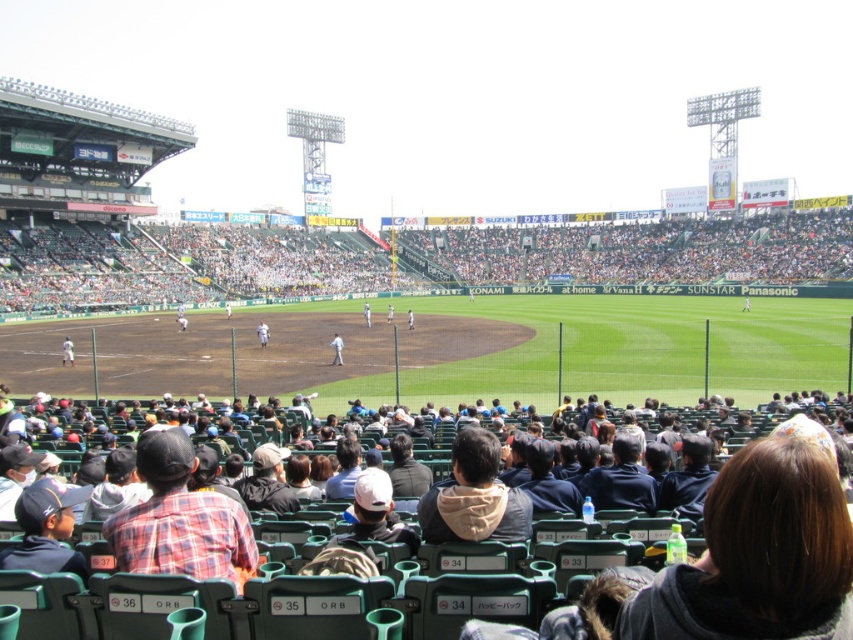
Does dark gray jacket at center have a larger size compared to white fabric uniform at center?

No.

Is dark gray jacket at center closer to the viewer compared to white fabric uniform at center?

Yes.

Describe the element at coordinates (405, 474) in the screenshot. I see `dark gray jacket at center` at that location.

Where is `dark gray jacket at center`? The width and height of the screenshot is (853, 640). dark gray jacket at center is located at coordinates (405, 474).

Is dark blue jersey at lower left shorter than dark blue hoodie at center?

No, dark blue jersey at lower left is not shorter than dark blue hoodie at center.

Does dark blue jersey at lower left have a greater height compared to dark blue hoodie at center?

Indeed, dark blue jersey at lower left has a greater height compared to dark blue hoodie at center.

Who is more forward, (36, 502) or (532, 444)?

Point (36, 502)

Image resolution: width=853 pixels, height=640 pixels. Find the location of `dark blue jersey at lower left`. dark blue jersey at lower left is located at coordinates (45, 529).

Who is taller, dark blue jersey at lower left or dark blue jacket at center?

Standing taller between the two is dark blue jacket at center.

Is dark blue jersey at lower left shorter than dark blue jacket at center?

Yes.

Measure the distance between point (38,534) and camera.

Point (38,534) is 37.94 meters from camera.

Locate an element on the screen. The height and width of the screenshot is (640, 853). dark blue jersey at lower left is located at coordinates (45, 529).